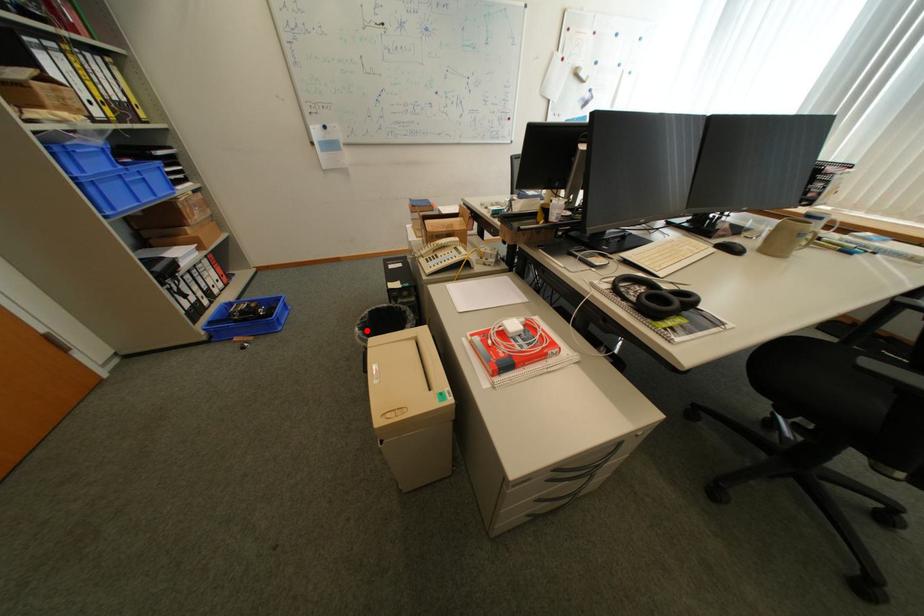
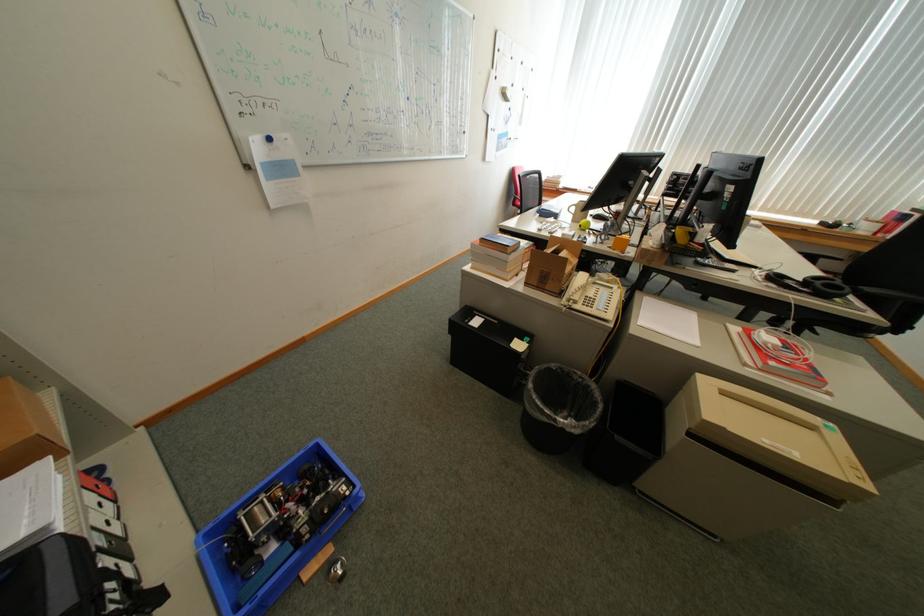
Question: I am providing you with two images of the same scene from different viewpoints. A red point is marked on the first image. At the location where the point appears in image 1, is it still visible in image 2?

Choices:
 (A) Yes
 (B) No

Answer: (A)